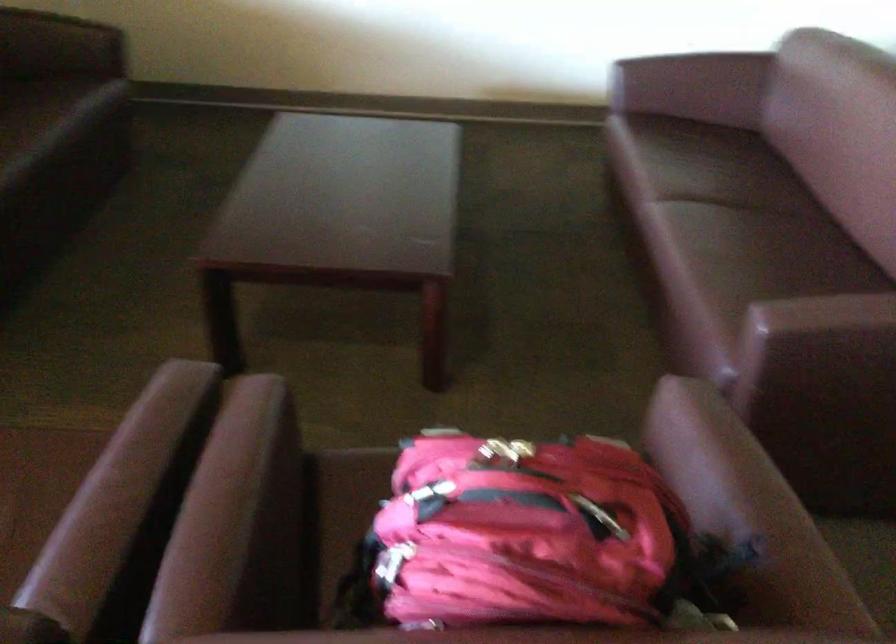
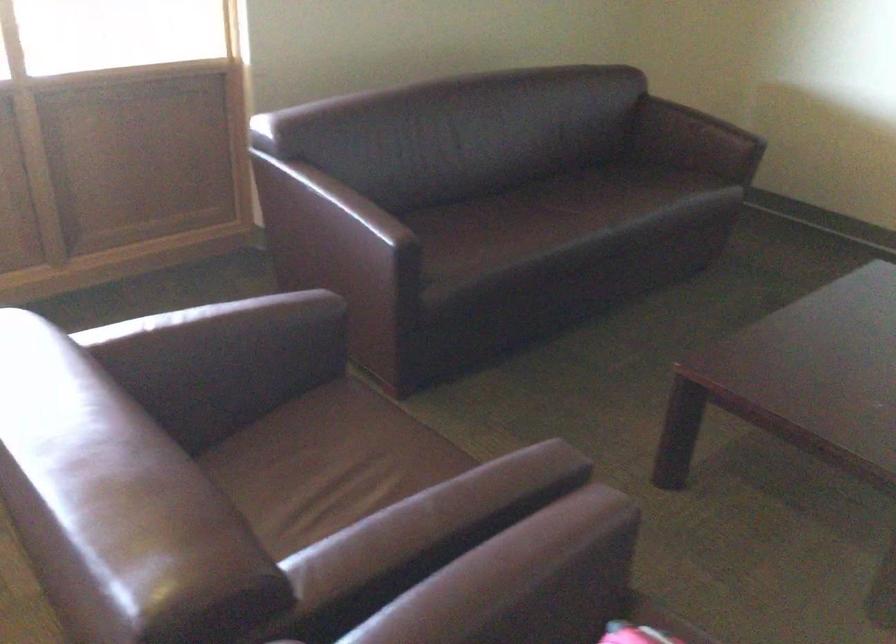
In the second image, find the point that corresponds to the point at 135,478 in the first image.

(431, 522)